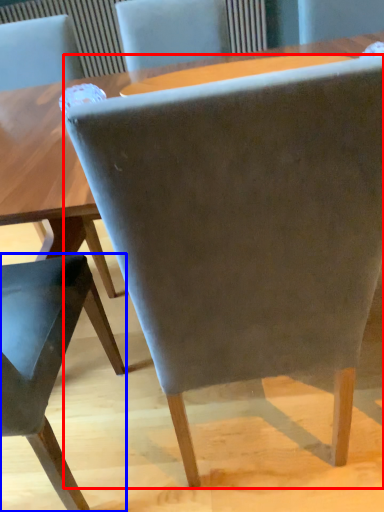
Question: Among these objects, which one is farthest to the camera, chair (highlighted by a red box) or chair (highlighted by a blue box)?

Choices:
 (A) chair
 (B) chair

Answer: (B)